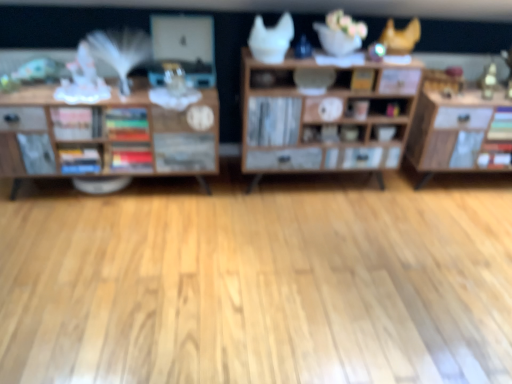
Find the location of a particular element. The image size is (512, 384). vacant space in front of wooden cabinet at center, the first shelf positioned from the right is located at coordinates (307, 262).